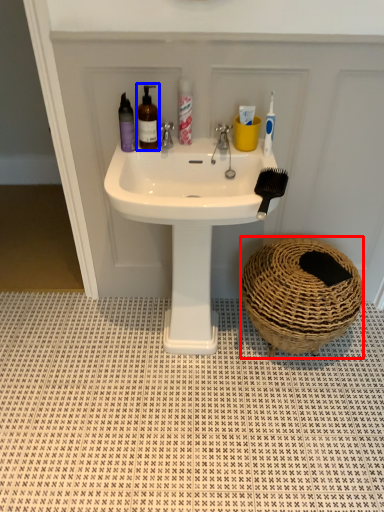
Question: Which object appears closest to the camera in this image, basket (highlighted by a red box) or mouthwash (highlighted by a blue box)?

Choices:
 (A) basket
 (B) mouthwash

Answer: (B)